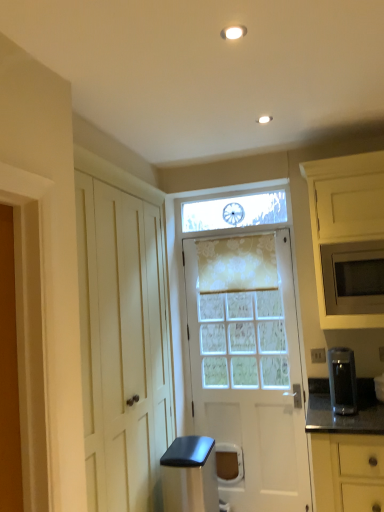
Describe the element at coordinates (237, 264) in the screenshot. This screenshot has height=512, width=384. I see `floral sheer curtain at center` at that location.

The image size is (384, 512). What do you see at coordinates (353, 277) in the screenshot?
I see `matte gray microwave at right` at bounding box center [353, 277].

Image resolution: width=384 pixels, height=512 pixels. Describe the element at coordinates (341, 440) in the screenshot. I see `yellow matte cabinet at lower right, positioned as the 1th cabinetry in bottom-to-top order` at that location.

Measure the distance between satin black trash can at lower center, which is counted as the first appliance, starting from the bottom, and camera.

They are 2.30 meters apart.

This screenshot has height=512, width=384. Identify the location of floral sheer curtain at center. (237, 264).

Is matte gray microwave at right bigger than yellow matte cabinet at lower right, which is counted as the second cabinetry, starting from the top?

Actually, matte gray microwave at right might be smaller than yellow matte cabinet at lower right, which is counted as the second cabinetry, starting from the top.

Which of these two, matte gray microwave at right or yellow matte cabinet at lower right, positioned as the 1th cabinetry in bottom-to-top order, stands taller?

With more height is yellow matte cabinet at lower right, positioned as the 1th cabinetry in bottom-to-top order.

Would you say matte gray microwave at right is inside or outside yellow matte cabinet at lower right, which is counted as the second cabinetry, starting from the top?

matte gray microwave at right is located beyond the bounds of yellow matte cabinet at lower right, which is counted as the second cabinetry, starting from the top.

Which of these two, satin black coffee maker at right, the 2th appliance in the bottom-to-top sequence, or matte gray microwave at right, is wider?

matte gray microwave at right.

Is satin black coffee maker at right, which appears as the second appliance when viewed from the left, positioned far away from matte gray microwave at right?

satin black coffee maker at right, which appears as the second appliance when viewed from the left, is near matte gray microwave at right, not far away.

Considering the relative sizes of satin black coffee maker at right, which appears as the second appliance when viewed from the left, and matte gray microwave at right in the image provided, is satin black coffee maker at right, which appears as the second appliance when viewed from the left, smaller than matte gray microwave at right?

Indeed, satin black coffee maker at right, which appears as the second appliance when viewed from the left, has a smaller size compared to matte gray microwave at right.

Is satin black coffee maker at right, the first appliance when ordered from right to left, not within matte gray microwave at right?

That's correct, satin black coffee maker at right, the first appliance when ordered from right to left, is outside of matte gray microwave at right.

What's the angular difference between white textured door at center and yellow matte cabinet at lower right, positioned as the 1th cabinetry in bottom-to-top order,'s facing directions?

The angular difference between white textured door at center and yellow matte cabinet at lower right, positioned as the 1th cabinetry in bottom-to-top order, is 2.29 degrees.

Can you confirm if white textured door at center is positioned to the right of yellow matte cabinet at lower right, positioned as the 1th cabinetry in bottom-to-top order?

→ No, white textured door at center is not to the right of yellow matte cabinet at lower right, positioned as the 1th cabinetry in bottom-to-top order.

From the image's perspective, is white textured door at center beneath yellow matte cabinet at lower right, which is counted as the second cabinetry, starting from the top?

No, from the image's perspective, white textured door at center is not below yellow matte cabinet at lower right, which is counted as the second cabinetry, starting from the top.

Considering the relative sizes of white textured door at center and yellow matte cabinet at lower right, which is counted as the second cabinetry, starting from the top, in the image provided, is white textured door at center taller than yellow matte cabinet at lower right, which is counted as the second cabinetry, starting from the top,?

Yes, white textured door at center is taller than yellow matte cabinet at lower right, which is counted as the second cabinetry, starting from the top.

From a real-world perspective, who is located higher, yellow matte cabinet at lower right, which is counted as the second cabinetry, starting from the top, or white textured door at center?

white textured door at center, from a real-world perspective.

How much distance is there between yellow matte cabinet at lower right, positioned as the 1th cabinetry in bottom-to-top order, and white textured door at center?

A distance of 37.30 inches exists between yellow matte cabinet at lower right, positioned as the 1th cabinetry in bottom-to-top order, and white textured door at center.

Identify the location of the 2nd cabinetry in front of the white textured door at center. (341, 440).

Which of these two, yellow matte cabinet at lower right, positioned as the 1th cabinetry in bottom-to-top order, or white textured door at center, is bigger?

With larger size is white textured door at center.

What's the angular difference between floral sheer curtain at center and matte gray microwave at right's facing directions?

2.09 degrees.

Is floral sheer curtain at center not near matte gray microwave at right?

No, there isn't a large distance between floral sheer curtain at center and matte gray microwave at right.

From a real-world perspective, which object stands above the other?

floral sheer curtain at center, from a real-world perspective.

In the scene shown: Between floral sheer curtain at center and matte gray microwave at right, which one has larger size?

With larger size is matte gray microwave at right.

Is satin black trash can at lower center, arranged as the second appliance when viewed from the top, further to camera compared to satin black coffee maker at right, the 2th appliance in the bottom-to-top sequence?

That is True.

Which object is positioned more to the right, satin black trash can at lower center, the first appliance from the left, or satin black coffee maker at right, which is the first appliance in top-to-bottom order?

Positioned to the right is satin black coffee maker at right, which is the first appliance in top-to-bottom order.

Looking at this image, from a real-world perspective, does satin black trash can at lower center, the first appliance from the left, stand above satin black coffee maker at right, which is the first appliance in top-to-bottom order?

No, from a real-world perspective, satin black trash can at lower center, the first appliance from the left, is not above satin black coffee maker at right, which is the first appliance in top-to-bottom order.

From a real-world perspective, does matte white microwave at right, which is the 1th cabinetry from top to bottom, sit lower than yellow matte cabinet at lower right, positioned as the 1th cabinetry in bottom-to-top order?

Actually, matte white microwave at right, which is the 1th cabinetry from top to bottom, is physically above yellow matte cabinet at lower right, positioned as the 1th cabinetry in bottom-to-top order, in the real world.

In the scene shown: Could you tell me if matte white microwave at right, the second cabinetry ordered from the bottom, is facing yellow matte cabinet at lower right, positioned as the 1th cabinetry in bottom-to-top order?

No, matte white microwave at right, the second cabinetry ordered from the bottom, does not turn towards yellow matte cabinet at lower right, positioned as the 1th cabinetry in bottom-to-top order.

Between matte white microwave at right, which is the 1th cabinetry from top to bottom, and yellow matte cabinet at lower right, positioned as the 1th cabinetry in bottom-to-top order, which one appears on the right side from the viewer's perspective?

matte white microwave at right, which is the 1th cabinetry from top to bottom, is more to the right.

Locate an element on the screen. The height and width of the screenshot is (512, 384). microwave oven that appears above the yellow matte cabinet at lower right, positioned as the 1th cabinetry in bottom-to-top order (from a real-world perspective) is located at coordinates (353, 277).

Locate an element on the screen. microwave oven behind the satin black coffee maker at right, the 2th appliance in the bottom-to-top sequence is located at coordinates (353, 277).

Looking at this image, based on their spatial positions, is floral sheer curtain at center or satin black trash can at lower center, arranged as the second appliance when viewed from the top, further from matte gray microwave at right?

The object further to matte gray microwave at right is satin black trash can at lower center, arranged as the second appliance when viewed from the top.

When comparing their distances from satin black trash can at lower center, arranged as the second appliance when viewed from the top, does matte gray microwave at right or floral sheer curtain at center seem closer?

floral sheer curtain at center is positioned closer to the anchor satin black trash can at lower center, arranged as the second appliance when viewed from the top.

Based on their spatial positions, is satin black coffee maker at right, the first appliance when ordered from right to left, or yellow matte cabinet at lower right, positioned as the 1th cabinetry in bottom-to-top order, further from matte white microwave at right, which is the 1th cabinetry from top to bottom?

Among the two, yellow matte cabinet at lower right, positioned as the 1th cabinetry in bottom-to-top order, is located further to matte white microwave at right, which is the 1th cabinetry from top to bottom.

Considering their positions, is yellow matte cabinet at lower right, positioned as the 1th cabinetry in bottom-to-top order, positioned further to matte white microwave at right, which is the 1th cabinetry from top to bottom, than satin black coffee maker at right, the first appliance when ordered from right to left?

Based on the image, yellow matte cabinet at lower right, positioned as the 1th cabinetry in bottom-to-top order, appears to be further to matte white microwave at right, which is the 1th cabinetry from top to bottom.

Which object lies nearer to the anchor point yellow matte cabinet at lower right, which is counted as the second cabinetry, starting from the top, floral sheer curtain at center or satin black trash can at lower center, acting as the 2th appliance starting from the right?

satin black trash can at lower center, acting as the 2th appliance starting from the right, lies closer to yellow matte cabinet at lower right, which is counted as the second cabinetry, starting from the top, than the other object.

When comparing their distances from satin black coffee maker at right, the 2th appliance in the bottom-to-top sequence, does white textured door at center or satin black trash can at lower center, arranged as the second appliance when viewed from the top, seem further?

The object further to satin black coffee maker at right, the 2th appliance in the bottom-to-top sequence, is satin black trash can at lower center, arranged as the second appliance when viewed from the top.

In the scene shown: From the image, which object appears to be nearer to matte white microwave at right, which is the 1th cabinetry from top to bottom, satin black coffee maker at right, the first appliance when ordered from right to left, or matte gray microwave at right?

matte gray microwave at right lies closer to matte white microwave at right, which is the 1th cabinetry from top to bottom, than the other object.

Estimate the real-world distances between objects in this image. Which object is closer to floral sheer curtain at center, yellow matte cabinet at lower right, which is counted as the second cabinetry, starting from the top, or matte white microwave at right, which is the 1th cabinetry from top to bottom?

matte white microwave at right, which is the 1th cabinetry from top to bottom, lies closer to floral sheer curtain at center than the other object.

At what (x,y) coordinates should I click in order to perform the action: click on microwave oven between floral sheer curtain at center and yellow matte cabinet at lower right, which is counted as the second cabinetry, starting from the top, in the vertical direction. Please return your answer as a coordinate pair (x, y). Image resolution: width=384 pixels, height=512 pixels. Looking at the image, I should click on (353, 277).

Locate an element on the screen. This screenshot has height=512, width=384. cabinetry between floral sheer curtain at center and satin black trash can at lower center, the first appliance from the left, in the vertical direction is located at coordinates (341, 440).

The width and height of the screenshot is (384, 512). What are the coordinates of `door between matte white microwave at right, which is the 1th cabinetry from top to bottom, and satin black coffee maker at right, which appears as the second appliance when viewed from the left, from top to bottom` in the screenshot? It's located at (250, 379).

The height and width of the screenshot is (512, 384). What are the coordinates of `appliance between matte white microwave at right, which is the 1th cabinetry from top to bottom, and satin black trash can at lower center, which is counted as the first appliance, starting from the bottom, from top to bottom` in the screenshot? It's located at (342, 380).